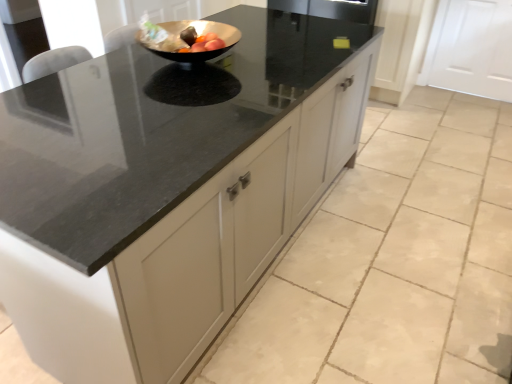
Question: Is white matte door at upper right bigger or smaller than metallic gold bowl at center?

Choices:
 (A) small
 (B) big

Answer: (B)

Question: Is white matte door at upper right wider or thinner than metallic gold bowl at center?

Choices:
 (A) wide
 (B) thin

Answer: (B)

Question: Is white matte door at upper right inside or outside of metallic gold bowl at center?

Choices:
 (A) inside
 (B) outside

Answer: (B)

Question: Is metallic gold bowl at center wider or thinner than white matte door at upper right?

Choices:
 (A) wide
 (B) thin

Answer: (A)

Question: Based on their positions, is metallic gold bowl at center located to the left or right of white matte door at upper right?

Choices:
 (A) left
 (B) right

Answer: (A)

Question: Would you say metallic gold bowl at center is inside or outside white matte door at upper right?

Choices:
 (A) inside
 (B) outside

Answer: (B)

Question: Is point (189, 26) closer or farther from the camera than point (442, 77)?

Choices:
 (A) farther
 (B) closer

Answer: (B)